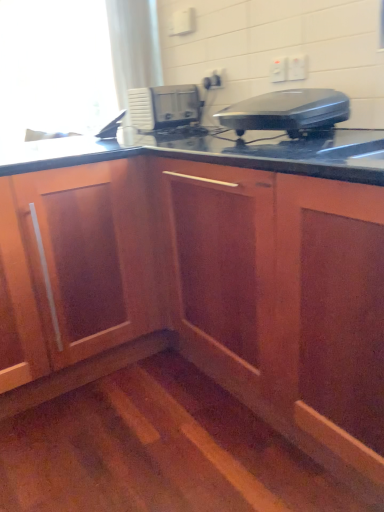
In the scene shown: Measure the distance between point (x=219, y=73) and camera.

Point (x=219, y=73) and camera are 6.56 feet apart.

You are a GUI agent. You are given a task and a screenshot of the screen. Output one action in this format:
    pyautogui.click(x=<x>, y=<y>)
    Task: Click on the wooden cabinet at center
    
    Given the screenshot: What is the action you would take?
    pyautogui.click(x=206, y=276)

The height and width of the screenshot is (512, 384). What do you see at coordinates (206, 276) in the screenshot? I see `wooden cabinet at center` at bounding box center [206, 276].

Describe the element at coordinates (53, 71) in the screenshot. The width and height of the screenshot is (384, 512). I see `transparent glass window screen at upper left` at that location.

Find the location of a particular element. black plastic toaster at upper right, which is the 1th home appliance from right to left is located at coordinates (288, 112).

Where is `white plastic electric outlet at upper center, positioned as the third electric outlet in front-to-back order`? This screenshot has height=512, width=384. white plastic electric outlet at upper center, positioned as the third electric outlet in front-to-back order is located at coordinates (213, 80).

From a real-world perspective, is wooden cabinet at center physically above white plastic microwave at center, the first home appliance from the back?

Actually, wooden cabinet at center is physically below white plastic microwave at center, the first home appliance from the back, in the real world.

Visually, is wooden cabinet at center positioned to the left or to the right of white plastic microwave at center, which ranks as the 2th home appliance in front-to-back order?

From the image, it's evident that wooden cabinet at center is to the right of white plastic microwave at center, which ranks as the 2th home appliance in front-to-back order.

Is wooden cabinet at center positioned in front of white plastic microwave at center, placed as the 1th home appliance when sorted from top to bottom?

Yes, the depth of wooden cabinet at center is less than that of white plastic microwave at center, placed as the 1th home appliance when sorted from top to bottom.

From the image's perspective, relative to wooden cabinet at center, is white plastic electric outlet at upper center, which is counted as the second electric outlet, starting from the right, above or below?

white plastic electric outlet at upper center, which is counted as the second electric outlet, starting from the right, is situated higher than wooden cabinet at center in the image.

Which is more to the right, white plastic electric outlet at upper center, the second electric outlet positioned from the left, or wooden cabinet at center?

Positioned to the right is white plastic electric outlet at upper center, the second electric outlet positioned from the left.

Is white plastic electric outlet at upper center, the second electric outlet positioned from the left, in front of or behind wooden cabinet at center in the image?

white plastic electric outlet at upper center, the second electric outlet positioned from the left, is positioned farther from the viewer than wooden cabinet at center.

Consider the image. How different are the orientations of white plastic electric outlet at upper center, the second electric outlet positioned from the left, and wooden cabinet at center in degrees?

0.378 degrees.

Which of these two, black plastic toaster at upper right, which is counted as the 1th home appliance, starting from the bottom, or wooden cabinet at center, is thinner?

Thinner between the two is black plastic toaster at upper right, which is counted as the 1th home appliance, starting from the bottom.

Looking at the image, does black plastic toaster at upper right, which appears as the 2th home appliance when viewed from the top, seem bigger or smaller compared to wooden cabinet at center?

black plastic toaster at upper right, which appears as the 2th home appliance when viewed from the top, is smaller than wooden cabinet at center.

Is black plastic toaster at upper right, which ranks as the 2th home appliance in back-to-front order, facing towards wooden cabinet at center?

No, black plastic toaster at upper right, which ranks as the 2th home appliance in back-to-front order, is not aimed at wooden cabinet at center.

Considering the sizes of objects black plastic toaster at upper right, which ranks as the 2th home appliance in back-to-front order, and wooden cabinet at center in the image provided, who is taller, black plastic toaster at upper right, which ranks as the 2th home appliance in back-to-front order, or wooden cabinet at center?

With more height is wooden cabinet at center.

Considering the relative sizes of white plastic electric outlet at upper center, positioned as the third electric outlet in front-to-back order, and wooden cabinet at center in the image provided, is white plastic electric outlet at upper center, positioned as the third electric outlet in front-to-back order, taller than wooden cabinet at center?

In fact, white plastic electric outlet at upper center, positioned as the third electric outlet in front-to-back order, may be shorter than wooden cabinet at center.

Is white plastic electric outlet at upper center, marked as the first electric outlet in a left-to-right arrangement, facing away from wooden cabinet at center?

No, white plastic electric outlet at upper center, marked as the first electric outlet in a left-to-right arrangement, is not facing away from wooden cabinet at center.

From a real-world perspective, does white plastic electric outlet at upper center, positioned as the third electric outlet in front-to-back order, sit lower than wooden cabinet at center?

No.

Between white plastic electric outlet at upper center, marked as the first electric outlet in a left-to-right arrangement, and wooden cabinet at center, which one has larger width?

With larger width is wooden cabinet at center.

Would you say white plastic electric outlet at upper right, the third electric outlet when ordered from back to front, is inside or outside white plastic electric outlet at upper center, marked as the first electric outlet in a left-to-right arrangement?

white plastic electric outlet at upper right, the third electric outlet when ordered from back to front, lies outside white plastic electric outlet at upper center, marked as the first electric outlet in a left-to-right arrangement.

From the image's perspective, is white plastic electric outlet at upper right, the first electric outlet viewed from the front, on white plastic electric outlet at upper center, marked as the first electric outlet in a left-to-right arrangement?

Incorrect, from the image's perspective, white plastic electric outlet at upper right, the first electric outlet viewed from the front, is lower than white plastic electric outlet at upper center, marked as the first electric outlet in a left-to-right arrangement.

Looking at their sizes, would you say white plastic electric outlet at upper right, the 3th electric outlet from the left, is wider or thinner than white plastic electric outlet at upper center, placed as the 3th electric outlet when sorted from right to left?

white plastic electric outlet at upper right, the 3th electric outlet from the left, is wider than white plastic electric outlet at upper center, placed as the 3th electric outlet when sorted from right to left.

Starting from the white plastic electric outlet at upper right, the 3th electric outlet from the left, which electric outlet is the 2nd one behind? Please provide its 2D coordinates.

[(213, 80)]

Is black plastic toaster at upper right, which appears as the 2th home appliance when viewed from the top, positioned behind white plastic microwave at center, placed as the 1th home appliance when sorted from left to right?

No, it is not.

Looking at this image, from a real-world perspective, is black plastic toaster at upper right, which is the 1th home appliance from right to left, physically located above or below white plastic microwave at center, which ranks as the 2th home appliance in front-to-back order?

In terms of real-world spatial position, black plastic toaster at upper right, which is the 1th home appliance from right to left, is below white plastic microwave at center, which ranks as the 2th home appliance in front-to-back order.

Can you tell me how much black plastic toaster at upper right, which is the 1th home appliance from right to left, and white plastic microwave at center, which is counted as the second home appliance, starting from the bottom, differ in facing direction?

There is a 89.8-degree angle between the facing directions of black plastic toaster at upper right, which is the 1th home appliance from right to left, and white plastic microwave at center, which is counted as the second home appliance, starting from the bottom.

Looking at their sizes, would you say black plastic toaster at upper right, which is the 1th home appliance from right to left, is wider or thinner than white plastic microwave at center, the first home appliance from the back?

Considering their sizes, black plastic toaster at upper right, which is the 1th home appliance from right to left, looks broader than white plastic microwave at center, the first home appliance from the back.

From the image's perspective, between white plastic microwave at center, placed as the 1th home appliance when sorted from left to right, and white plastic electric outlet at upper right, the first electric outlet viewed from the front, who is located below?

white plastic electric outlet at upper right, the first electric outlet viewed from the front.

Which is behind, point (170, 119) or point (306, 69)?

Positioned behind is point (170, 119).

From a real-world perspective, which object stands above the other?

white plastic electric outlet at upper right, the third electric outlet when ordered from back to front, from a real-world perspective.

This screenshot has width=384, height=512. Identify the location of cabinetry in front of the white plastic microwave at center, the second home appliance when ordered from right to left. (206, 276).

Starting from the wooden cabinet at center, which electric outlet is the 2nd one behind? Please provide its 2D coordinates.

[(278, 70)]

Looking at the image, which one is located further to white plastic electric outlet at upper center, which is counted as the second electric outlet, starting from the right, white plastic electric outlet at upper center, arranged as the first electric outlet when viewed from the back, or white plastic microwave at center, which is counted as the second home appliance, starting from the bottom?

white plastic microwave at center, which is counted as the second home appliance, starting from the bottom.

In the scene shown: Estimate the real-world distances between objects in this image. Which object is closer to wooden cabinet at center, white plastic electric outlet at upper right, the first electric outlet viewed from the front, or transparent glass window screen at upper left?

white plastic electric outlet at upper right, the first electric outlet viewed from the front, is positioned closer to the anchor wooden cabinet at center.

When comparing their distances from black plastic toaster at upper right, which appears as the 2th home appliance when viewed from the top, does white plastic microwave at center, placed as the 1th home appliance when sorted from left to right, or transparent glass window screen at upper left seem further?

transparent glass window screen at upper left is further to black plastic toaster at upper right, which appears as the 2th home appliance when viewed from the top.

From the image, which object appears to be farther from transparent glass window screen at upper left, wooden cabinet at center or white plastic microwave at center, which is counted as the second home appliance, starting from the bottom?

The object further to transparent glass window screen at upper left is wooden cabinet at center.

Estimate the real-world distances between objects in this image. Which object is further from white plastic electric outlet at upper right, the 3th electric outlet from the left, white plastic electric outlet at upper center, marked as the first electric outlet in a left-to-right arrangement, or black plastic toaster at upper right, which ranks as the 2th home appliance in back-to-front order?

white plastic electric outlet at upper center, marked as the first electric outlet in a left-to-right arrangement.

Looking at the image, which one is located closer to white plastic electric outlet at upper center, placed as the 3th electric outlet when sorted from right to left, white plastic microwave at center, which ranks as the 2th home appliance in front-to-back order, or black plastic toaster at upper right, which is the first home appliance in front-to-back order?

white plastic microwave at center, which ranks as the 2th home appliance in front-to-back order, is positioned closer to the anchor white plastic electric outlet at upper center, placed as the 3th electric outlet when sorted from right to left.

Considering their positions, is transparent glass window screen at upper left positioned further to white plastic electric outlet at upper center, arranged as the first electric outlet when viewed from the back, than wooden cabinet at center?

transparent glass window screen at upper left is positioned further to the anchor white plastic electric outlet at upper center, arranged as the first electric outlet when viewed from the back.

Looking at the image, which one is located closer to wooden cabinet at center, black plastic toaster at upper right, which is counted as the 1th home appliance, starting from the bottom, or white plastic electric outlet at upper center, marked as the first electric outlet in a left-to-right arrangement?

black plastic toaster at upper right, which is counted as the 1th home appliance, starting from the bottom, lies closer to wooden cabinet at center than the other object.

Identify the location of electric outlet between white plastic microwave at center, which is counted as the second home appliance, starting from the bottom, and transparent glass window screen at upper left from front to back. Image resolution: width=384 pixels, height=512 pixels. (213, 80).

The image size is (384, 512). In order to click on home appliance between black plastic toaster at upper right, which is the 1th home appliance from right to left, and transparent glass window screen at upper left from front to back in this screenshot , I will do `click(163, 106)`.

Where is `electric outlet located between transparent glass window screen at upper left and white plastic electric outlet at upper center, which is the 2th electric outlet in front-to-back order, in the left-right direction`? electric outlet located between transparent glass window screen at upper left and white plastic electric outlet at upper center, which is the 2th electric outlet in front-to-back order, in the left-right direction is located at coordinates (213, 80).

Where is `home appliance positioned between white plastic electric outlet at upper right, the first electric outlet viewed from the front, and transparent glass window screen at upper left from near to far`? home appliance positioned between white plastic electric outlet at upper right, the first electric outlet viewed from the front, and transparent glass window screen at upper left from near to far is located at coordinates click(163, 106).